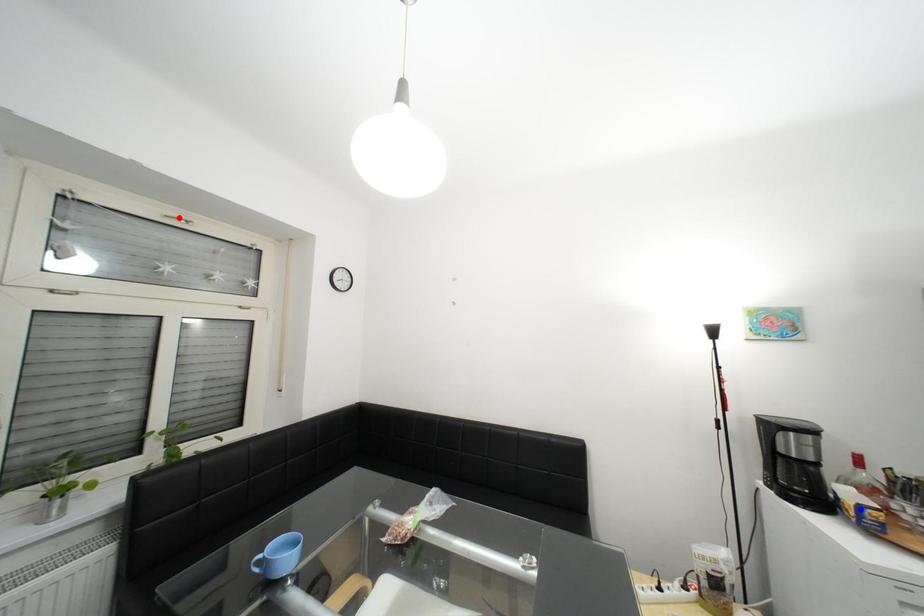
Question: Which of the two points in the image is closer to the camera?

Choices:
 (A) Blue point is closer.
 (B) Red point is closer.

Answer: (A)